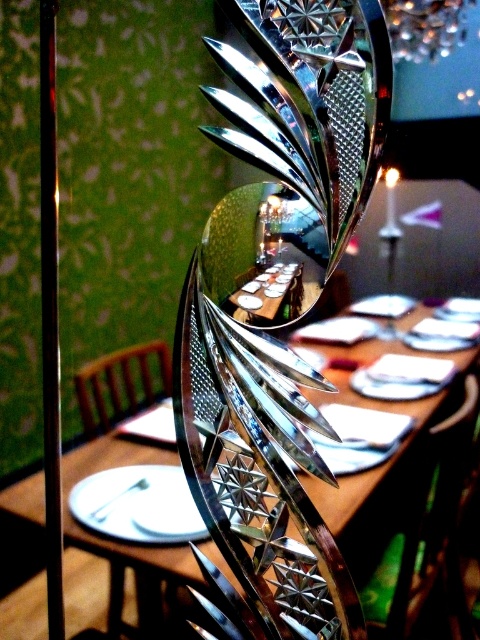
Is polished silver sculpture at center positioned at the back of metallic textured lamp at upper right?

That is True.

Can you confirm if polished silver sculpture at center is smaller than metallic textured lamp at upper right?

Actually, polished silver sculpture at center might be larger than metallic textured lamp at upper right.

This screenshot has height=640, width=480. Describe the element at coordinates (276, 305) in the screenshot. I see `polished silver sculpture at center` at that location.

The width and height of the screenshot is (480, 640). Find the location of `polished silver sculpture at center`. polished silver sculpture at center is located at coordinates (276, 305).

Does silvermetallicfork at right have a greater height compared to silver metallic spoon at center?

In fact, silvermetallicfork at right may be shorter than silver metallic spoon at center.

Who is more forward, (414, 384) or (104, 513)?

Point (414, 384)

Find the location of a particular element. silvermetallicfork at right is located at coordinates (405, 376).

Consider the image. Does polished silver sculpture at center have a lesser width compared to silver metallic spoon at center?

No, polished silver sculpture at center is not thinner than silver metallic spoon at center.

Describe the element at coordinates (276, 305) in the screenshot. The width and height of the screenshot is (480, 640). I see `polished silver sculpture at center` at that location.

Is point (286, 632) positioned in front of point (126, 493)?

Yes, point (286, 632) is closer to viewer.

Identify the location of polished silver sculpture at center. (276, 305).